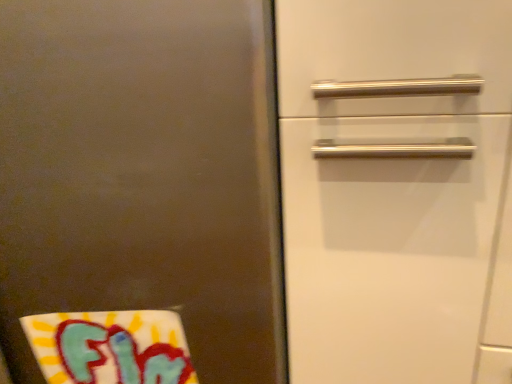
Describe the element at coordinates (111, 347) in the screenshot. I see `white fabric beach towel at lower left` at that location.

Measure the distance between white fabric beach towel at lower left and camera.

The distance of white fabric beach towel at lower left from camera is 27.09 inches.

You are a GUI agent. You are given a task and a screenshot of the screen. Output one action in this format:
    pyautogui.click(x=<x>, y=<y>)
    Task: Click on the white fabric beach towel at lower left
    
    Given the screenshot: What is the action you would take?
    pyautogui.click(x=111, y=347)

Describe the element at coordinates (139, 193) in the screenshot. I see `brushed metal refrigerator at left` at that location.

Find the location of `brushed metal refrigerator at left`. brushed metal refrigerator at left is located at coordinates (139, 193).

Where is `white fabric beach towel at lower left`? white fabric beach towel at lower left is located at coordinates (111, 347).

Considering the relative positions of white fabric beach towel at lower left and brushed metal refrigerator at left in the image provided, is white fabric beach towel at lower left to the left or to the right of brushed metal refrigerator at left?

Based on their positions, white fabric beach towel at lower left is located to the right of brushed metal refrigerator at left.

Between white fabric beach towel at lower left and brushed metal refrigerator at left, which one is positioned behind?

Positioned behind is white fabric beach towel at lower left.

Which is farther from the camera, (36, 340) or (112, 115)?

The point (36, 340) is behind.

From the image's perspective, between white fabric beach towel at lower left and brushed metal refrigerator at left, who is located below?

white fabric beach towel at lower left.

From a real-world perspective, between white fabric beach towel at lower left and brushed metal refrigerator at left, who is vertically lower?

From a 3D spatial view, white fabric beach towel at lower left is below.

Considering the relative sizes of white fabric beach towel at lower left and brushed metal refrigerator at left in the image provided, is white fabric beach towel at lower left wider than brushed metal refrigerator at left?

In fact, white fabric beach towel at lower left might be narrower than brushed metal refrigerator at left.

Considering the sizes of white fabric beach towel at lower left and brushed metal refrigerator at left in the image, is white fabric beach towel at lower left taller or shorter than brushed metal refrigerator at left?

Clearly, white fabric beach towel at lower left is shorter compared to brushed metal refrigerator at left.

Who is smaller, white fabric beach towel at lower left or brushed metal refrigerator at left?

white fabric beach towel at lower left.

Would you say brushed metal refrigerator at left is part of white fabric beach towel at lower left's contents?

No, brushed metal refrigerator at left is not a part of white fabric beach towel at lower left.

Is white fabric beach towel at lower left next to brushed metal refrigerator at left?

No, white fabric beach towel at lower left is not touching brushed metal refrigerator at left.

Is brushed metal refrigerator at left at the back of white fabric beach towel at lower left?

Yes.

The width and height of the screenshot is (512, 384). I want to click on beach towel behind the brushed metal refrigerator at left, so click(111, 347).

Between brushed metal refrigerator at left and white fabric beach towel at lower left, which one appears on the left side from the viewer's perspective?

brushed metal refrigerator at left.

Between brushed metal refrigerator at left and white fabric beach towel at lower left, which one is positioned in front?

brushed metal refrigerator at left is more forward.

Is point (58, 303) positioned in front of point (85, 337)?

Yes, point (58, 303) is in front of point (85, 337).

From the image's perspective, which object appears higher, brushed metal refrigerator at left or white fabric beach towel at lower left?

brushed metal refrigerator at left.

Looking at this image, from a real-world perspective, is brushed metal refrigerator at left over white fabric beach towel at lower left?

Correct, in the physical world, brushed metal refrigerator at left is higher than white fabric beach towel at lower left.

In terms of width, does brushed metal refrigerator at left look wider or thinner when compared to white fabric beach towel at lower left?

In the image, brushed metal refrigerator at left appears to be wider than white fabric beach towel at lower left.

Which of these two, brushed metal refrigerator at left or white fabric beach towel at lower left, stands taller?

Standing taller between the two is brushed metal refrigerator at left.

Can you confirm if brushed metal refrigerator at left is smaller than white fabric beach towel at lower left?

Incorrect, brushed metal refrigerator at left is not smaller in size than white fabric beach towel at lower left.

Is white fabric beach towel at lower left completely or partially inside brushed metal refrigerator at left?

Yes, white fabric beach towel at lower left is a part of brushed metal refrigerator at left.

Are brushed metal refrigerator at left and white fabric beach towel at lower left far apart?

brushed metal refrigerator at left is actually quite close to white fabric beach towel at lower left.

Is brushed metal refrigerator at left looking in the opposite direction of white fabric beach towel at lower left?

Yes, white fabric beach towel at lower left is at the back of brushed metal refrigerator at left.

At what (x,y) coordinates should I click in order to perform the action: click on beach towel on the right of brushed metal refrigerator at left. Please return your answer as a coordinate pair (x, y). Looking at the image, I should click on (111, 347).

The height and width of the screenshot is (384, 512). I want to click on door that is in front of the white fabric beach towel at lower left, so click(139, 193).

What are the coordinates of `beach towel to the right of brushed metal refrigerator at left` in the screenshot? It's located at (111, 347).